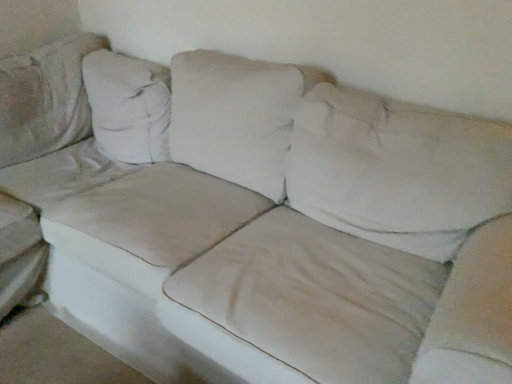
This screenshot has width=512, height=384. What do you see at coordinates (44, 152) in the screenshot? I see `suede beige couch at left` at bounding box center [44, 152].

In order to click on suede beige couch at left in this screenshot , I will do `click(44, 152)`.

At what (x,y) coordinates should I click in order to perform the action: click on suede beige couch at left. Please return your answer as a coordinate pair (x, y). The height and width of the screenshot is (384, 512). Looking at the image, I should click on (44, 152).